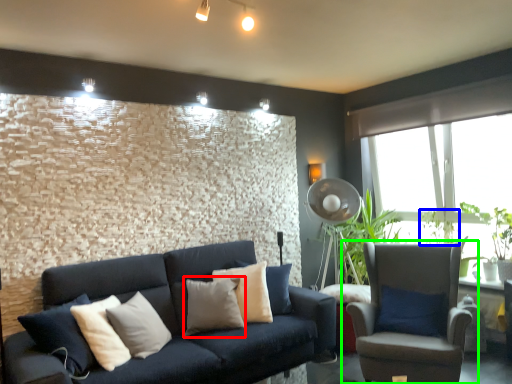
Question: Estimate the real-world distances between objects in this image. Which object is farther from pillow (highlighted by a red box), plant (highlighted by a blue box) or chair (highlighted by a green box)?

Choices:
 (A) plant
 (B) chair

Answer: (A)